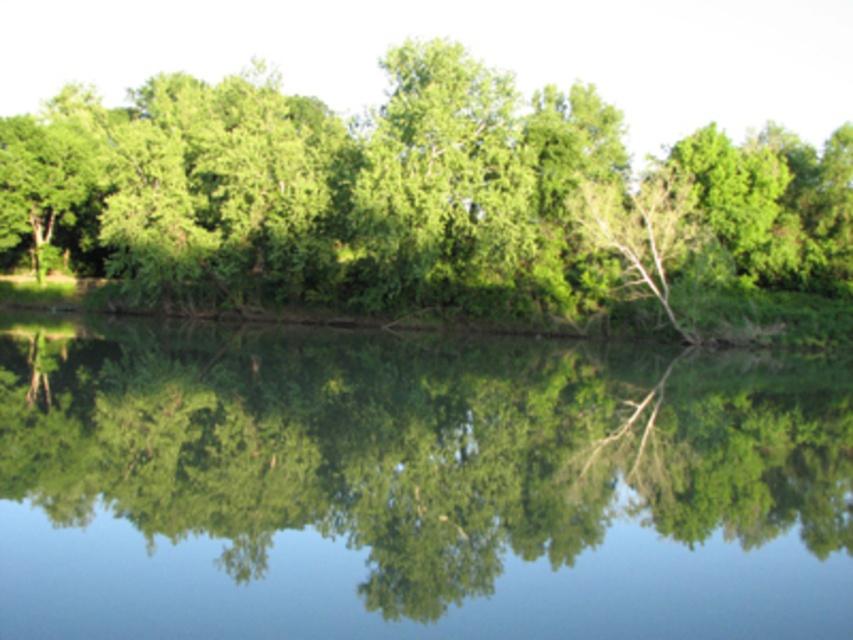
Consider the image. You are a photographer trying to capture the reflection of the green leafy tree at center in the green reflective water at center. Based on the scene, can you determine if the reflection will be fully visible within the water?

The green reflective water at center occupies less space than green leafy tree at center, so the reflection of the green leafy tree at center may not be fully visible within the green reflective water at center due to the water having a smaller area.

Looking at this image, you are standing at the edge of a forest and see the point labeled as point (412, 486) in the image. Based on the description, what does this point represent?

The point (412, 486) indicates green reflective water at center.